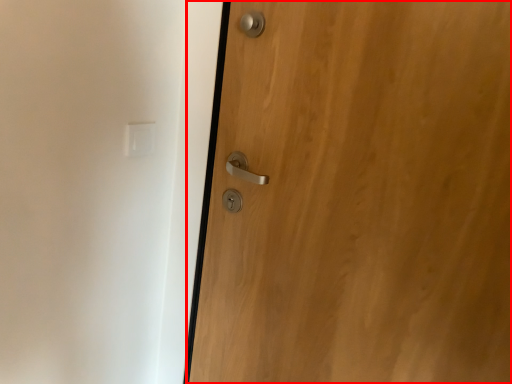
Question: From the image's perspective, what is the correct spatial positioning of door (annotated by the red box) in reference to light switch?

Choices:
 (A) below
 (B) above

Answer: (A)